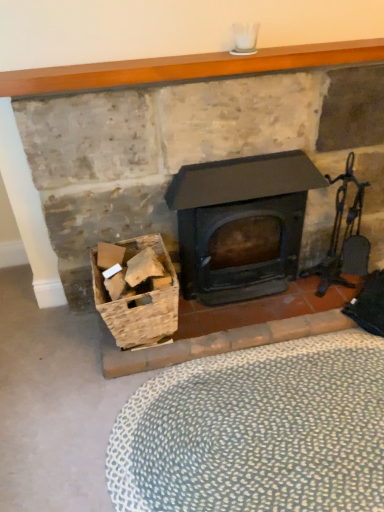
At what (x,y) coordinates should I click in order to perform the action: click on vacant space situated above smooth wooden mantle at upper center (from a real-world perspective). Please return your answer as a coordinate pair (x, y). The image size is (384, 512). Looking at the image, I should click on (144, 60).